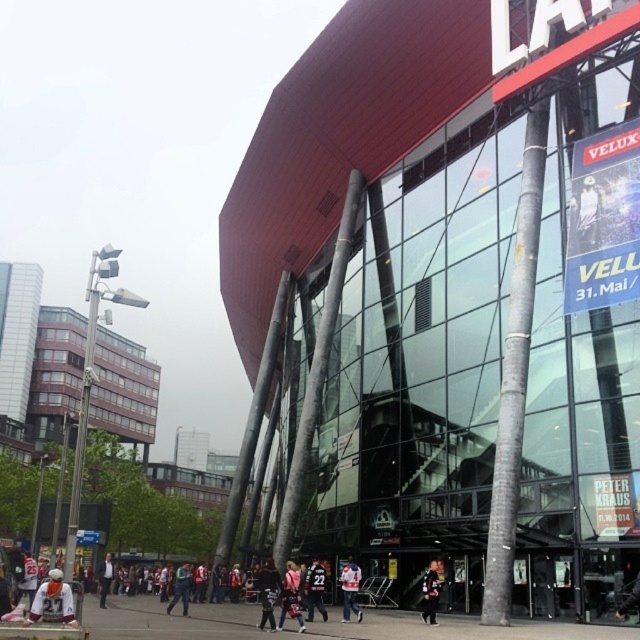
Is black leather jacket at lower center further to camera compared to dark blue jersey at center?

No, black leather jacket at lower center is closer to the viewer.

Does black leather jacket at lower center appear on the right side of dark blue jersey at center?

Yes, black leather jacket at lower center is to the right of dark blue jersey at center.

This screenshot has width=640, height=640. What do you see at coordinates (429, 593) in the screenshot?
I see `black leather jacket at lower center` at bounding box center [429, 593].

This screenshot has height=640, width=640. Identify the location of black leather jacket at lower center. (429, 593).

What do you see at coordinates (316, 589) in the screenshot?
I see `black jersey at center` at bounding box center [316, 589].

Is point (324, 611) in front of point (349, 614)?

Yes, point (324, 611) is closer to viewer.

You are a GUI agent. You are given a task and a screenshot of the screen. Output one action in this format:
    pyautogui.click(x=<x>, y=<y>)
    Task: Click on the black jersey at center
    This screenshot has height=640, width=640.
    Given the screenshot: What is the action you would take?
    pyautogui.click(x=316, y=589)

This screenshot has height=640, width=640. What do you see at coordinates (268, 593) in the screenshot?
I see `dark gray jacket at center` at bounding box center [268, 593].

Between dark gray jacket at center and dark gray jacket at lower left, which one is positioned higher?

Positioned higher is dark gray jacket at center.

Between point (273, 570) and point (100, 608), which one is positioned in front?

Point (273, 570) is more forward.

Identify the location of dark gray jacket at center. The image size is (640, 640). (268, 593).